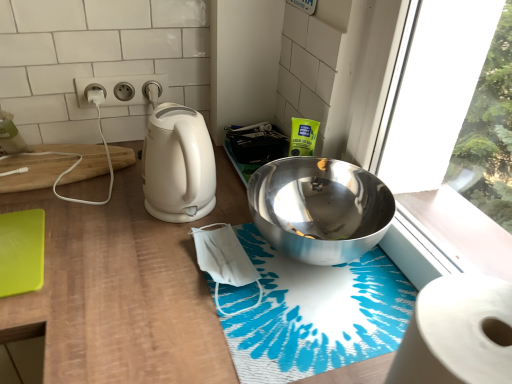
Image resolution: width=512 pixels, height=384 pixels. In order to click on free location above wooden at left (from a real-world perspective) in this screenshot , I will do `click(206, 249)`.